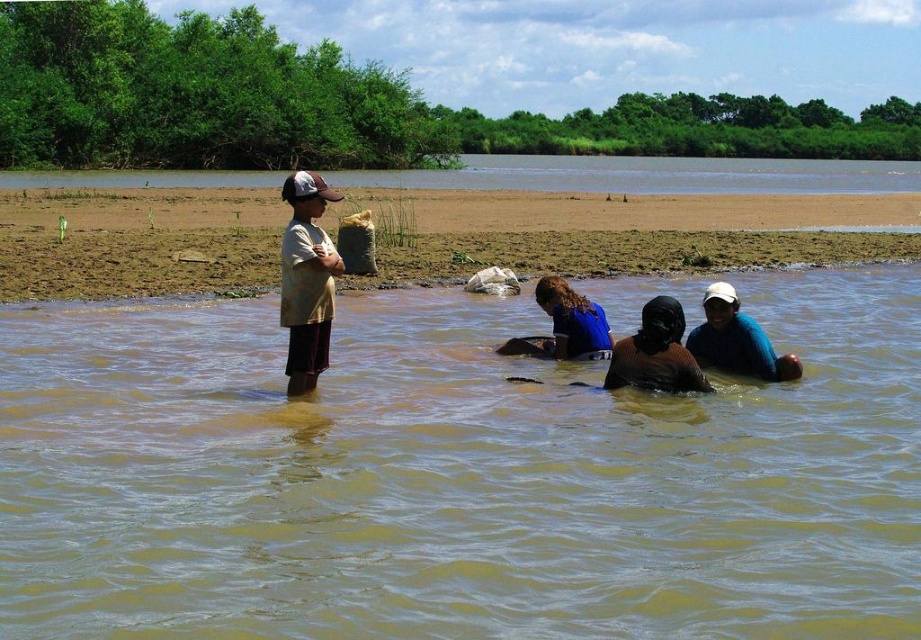
Question: Among these objects, which one is nearest to the camera?

Choices:
 (A) brown muddy ground at center
 (B) blue fabric at center
 (C) brown matte headscarf at center
 (D) brown sandy riverbank at upper center

Answer: (C)

Question: Is brown muddy water at center closer to camera compared to blue fabric at center?

Choices:
 (A) yes
 (B) no

Answer: (A)

Question: Can you confirm if blue fabric headscarf at lower center is positioned above blue fabric at center?

Choices:
 (A) no
 (B) yes

Answer: (A)

Question: Which point is closer to the camera?

Choices:
 (A) brown muddy ground at center
 (B) brown muddy water at center
 (C) matte yellow shirt at left

Answer: (B)

Question: Which object is closer to the camera taking this photo?

Choices:
 (A) brown muddy water at center
 (B) blue fabric at center
 (C) blue fabric headscarf at lower center
 (D) brown matte headscarf at center

Answer: (A)

Question: Does brown muddy water at center come behind brown sandy riverbank at upper center?

Choices:
 (A) yes
 (B) no

Answer: (B)